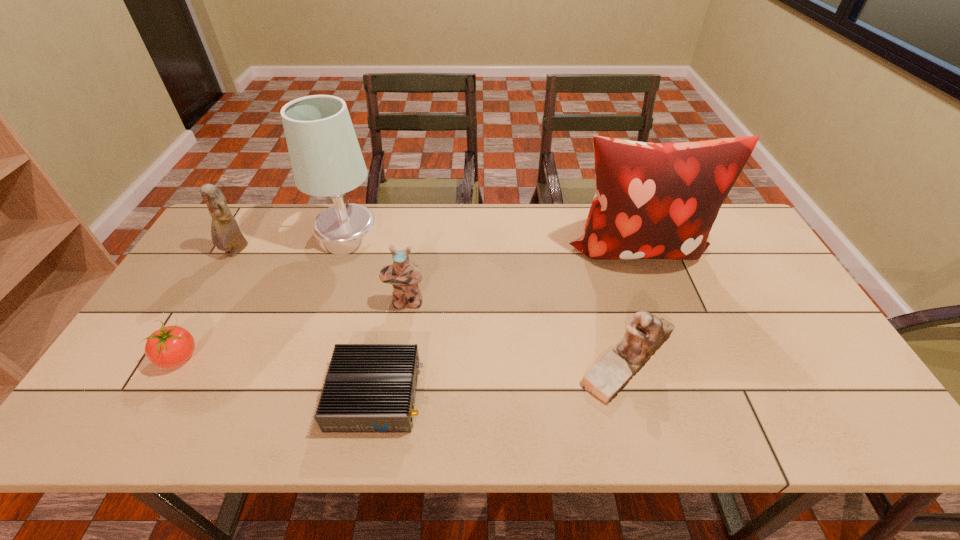
At what (x,y) coordinates should I click in order to perform the action: click on free space between the sixth tallest object and the lampshade. Please return your answer as a coordinate pair (x, y). This screenshot has width=960, height=540. Looking at the image, I should click on (263, 295).

At what (x,y) coordinates should I click in order to perform the action: click on vacant space in between the tomato and the fourth tallest object. Please return your answer as a coordinate pair (x, y). The image size is (960, 540). Looking at the image, I should click on (293, 329).

Where is `object identified as the closest to the cushion`? object identified as the closest to the cushion is located at coordinates (645, 333).

Locate which object is the sixth closest to the lampshade. Please provide its 2D coordinates. Your answer should be formatted as a tuple, i.e. [(x, y)], where the tuple contains the x and y coordinates of a point satisfying the conditions above.

[(645, 333)]

Locate an element on the screen. figurine that is the closest to the leftmost figurine is located at coordinates (404, 275).

Locate an element on the screen. The height and width of the screenshot is (540, 960). figurine that stands as the second closest to the fourth farthest object is located at coordinates (x=226, y=235).

Image resolution: width=960 pixels, height=540 pixels. What are the coordinates of `vacant space that satisfies the following two spatial constraints: 1. on the front-facing side of the second farthest figurine; 2. on the back panel of the shortest object` in the screenshot? It's located at (391, 395).